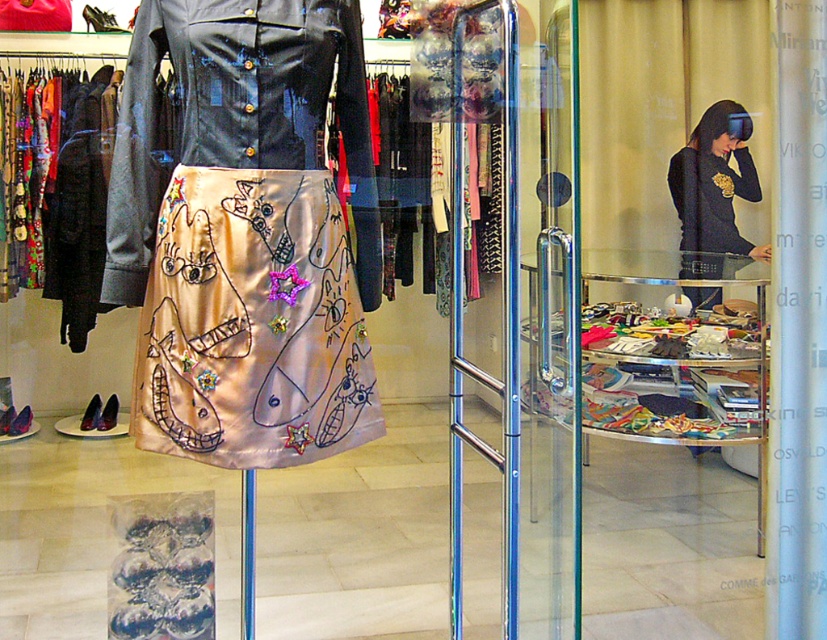
Identify the location of satin skirt at center. (252, 323).

Between satin skirt at center and shiny black jacket at center, which one has less height?

With less height is satin skirt at center.

Is point (289, 228) closer to viewer compared to point (318, 108)?

Yes.

Locate an element on the screen. The image size is (827, 640). satin skirt at center is located at coordinates pyautogui.click(x=252, y=323).

Is satin skirt at center positioned before black jersey at center?

Yes, satin skirt at center is closer to the viewer.

Does satin skirt at center have a lesser width compared to black jersey at center?

No, satin skirt at center is not thinner than black jersey at center.

Is point (218, 384) farther from viewer compared to point (698, 257)?

No, it is in front of (698, 257).

Locate an element on the screen. satin skirt at center is located at coordinates point(252,323).

Who is more distant from viewer, (300, 49) or (744, 134)?

The point (744, 134) is behind.

Is point (182, 28) farther from camera compared to point (734, 148)?

No, it is in front of (734, 148).

What do you see at coordinates (238, 115) in the screenshot?
I see `shiny black jacket at center` at bounding box center [238, 115].

Where is `shiny black jacket at center`? This screenshot has height=640, width=827. shiny black jacket at center is located at coordinates (238, 115).